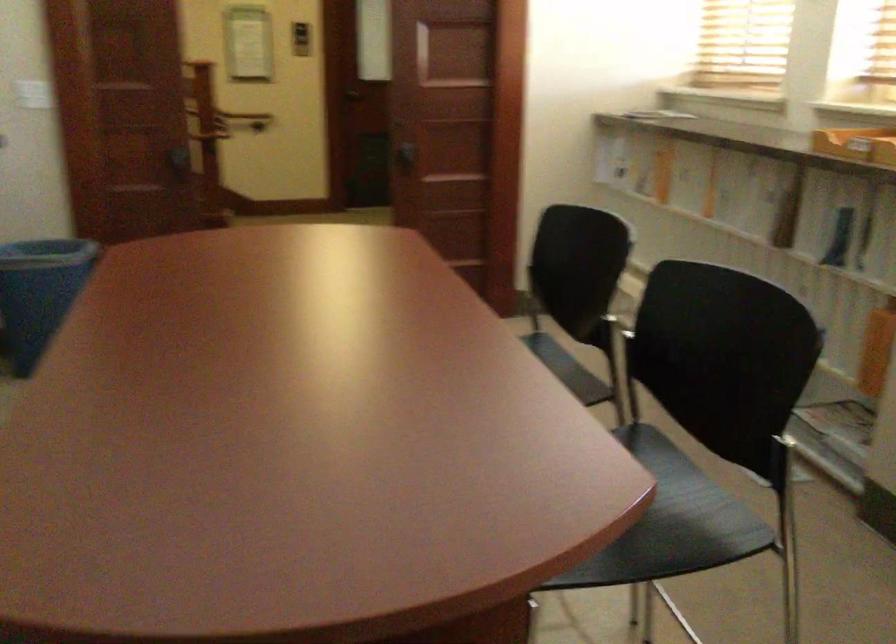
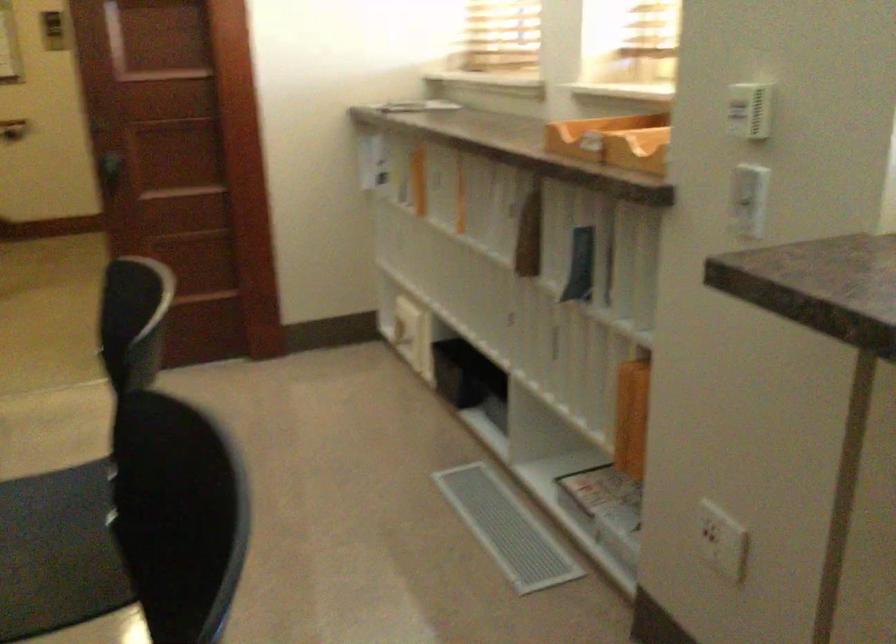
Question: How did the camera likely rotate?

Choices:
 (A) Left
 (B) Right
 (C) Up
 (D) Down

Answer: (B)